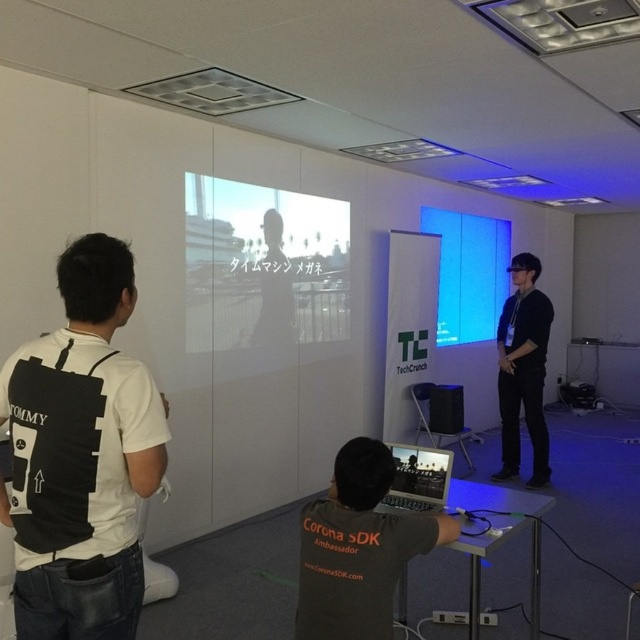
Who is higher up, black fabric backpack at left or blue glossy projection screen at center?

blue glossy projection screen at center is higher up.

Can you confirm if black fabric backpack at left is shorter than blue glossy projection screen at center?

Correct, black fabric backpack at left is not as tall as blue glossy projection screen at center.

You are a GUI agent. You are given a task and a screenshot of the screen. Output one action in this format:
    pyautogui.click(x=<x>, y=<y>)
    Task: Click on the black fabric backpack at left
    The height and width of the screenshot is (640, 640).
    Given the screenshot: What is the action you would take?
    pyautogui.click(x=81, y=456)

Locate an element on the screen. This screenshot has width=640, height=640. black fabric backpack at left is located at coordinates (81, 456).

What do you see at coordinates (358, 547) in the screenshot? I see `black matte shirt at center` at bounding box center [358, 547].

Looking at this image, who is taller, black matte shirt at center or black matte vr headset at right?

With more height is black matte vr headset at right.

The image size is (640, 640). What do you see at coordinates (358, 547) in the screenshot?
I see `black matte shirt at center` at bounding box center [358, 547].

Locate an element on the screen. black matte shirt at center is located at coordinates (358, 547).

Does blue glossy projection screen at center have a lesser width compared to silver metallic laptop at center?

In fact, blue glossy projection screen at center might be wider than silver metallic laptop at center.

Does blue glossy projection screen at center have a lesser height compared to silver metallic laptop at center?

No.

What are the coordinates of `blue glossy projection screen at center` in the screenshot? It's located at (468, 273).